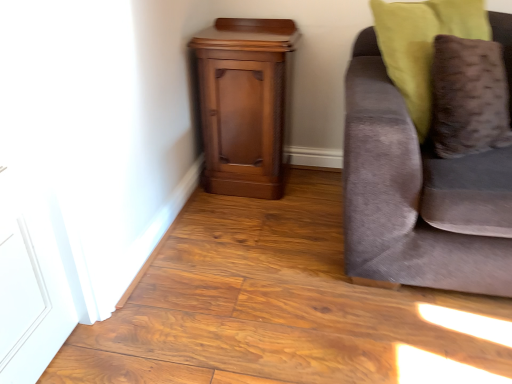
Where is `free point to the right of polished wood nightstand at lower left`? This screenshot has width=512, height=384. free point to the right of polished wood nightstand at lower left is located at coordinates (313, 190).